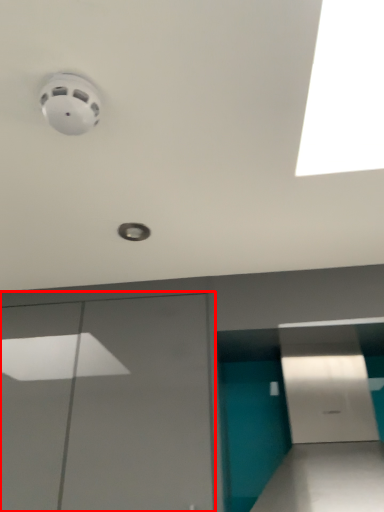
Question: Considering the relative positions of garage door (annotated by the red box) and parking garage in the image provided, where is garage door (annotated by the red box) located with respect to the staircase?

Choices:
 (A) left
 (B) right

Answer: (A)